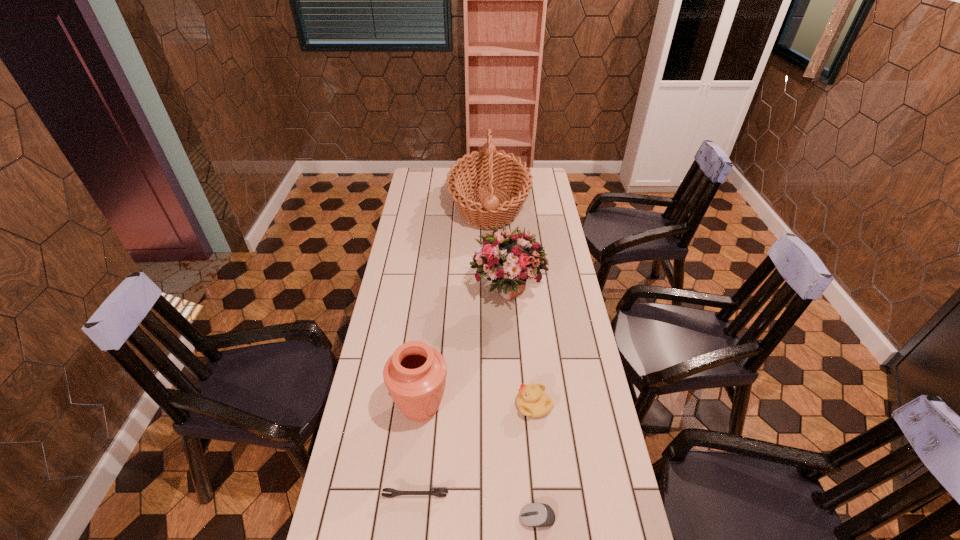
Image resolution: width=960 pixels, height=540 pixels. Identify the location of vacant space located 0.260m on the front of the bouquet. (514, 376).

Locate an element on the screen. The width and height of the screenshot is (960, 540). vacant space located on the front of the vase is located at coordinates (412, 490).

Locate an element on the screen. This screenshot has width=960, height=540. free region located on the beak of the fourth tallest object is located at coordinates point(388,406).

The width and height of the screenshot is (960, 540). What are the coordinates of `free location located 0.070m on the beak of the fourth tallest object` in the screenshot? It's located at (493, 406).

The height and width of the screenshot is (540, 960). Identify the location of free space located on the beak of the fourth tallest object. (x=484, y=406).

Locate an element on the screen. vacant space situated 0.090m on the open ends of the fifth tallest object is located at coordinates (412, 535).

I want to click on vacant area situated on the wheel side of the computer equipment, so click(468, 518).

Locate an element on the screen. free space located on the wheel side of the computer equipment is located at coordinates (387, 518).

This screenshot has width=960, height=540. I want to click on vacant space located on the wheel side of the computer equipment, so click(492, 518).

Locate an element on the screen. The image size is (960, 540). object present at the far edge is located at coordinates (490, 167).